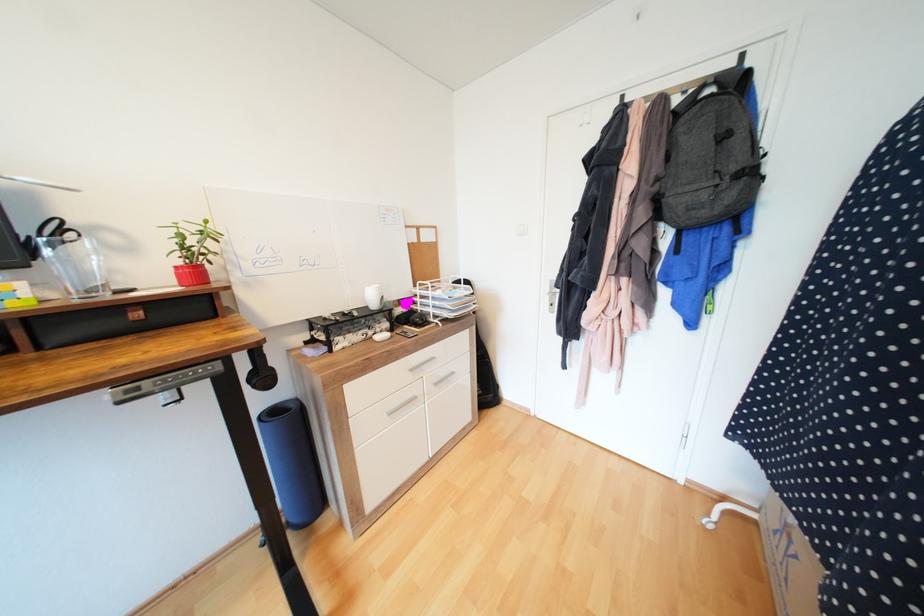
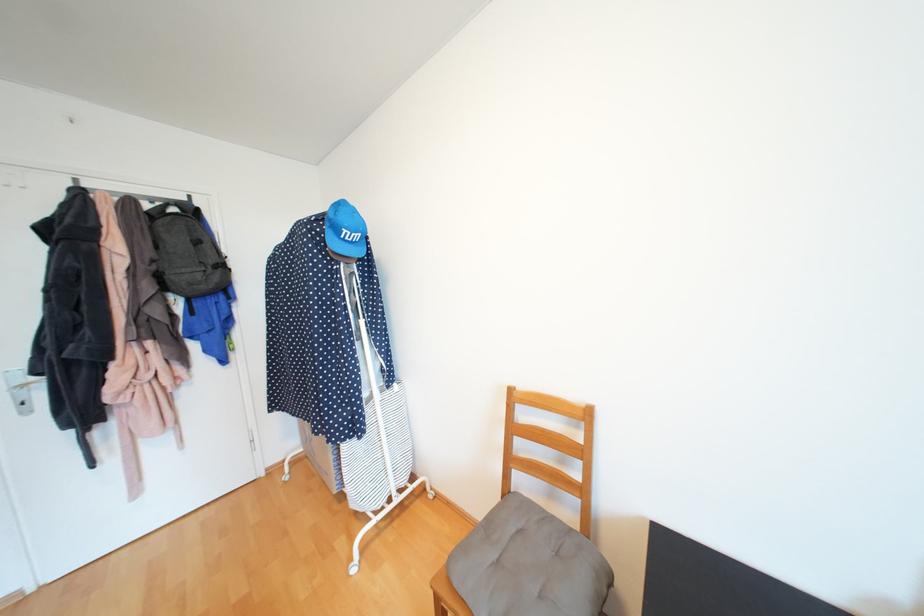
Find the pixel in the second image that matches (663,180) in the first image.

(160, 262)